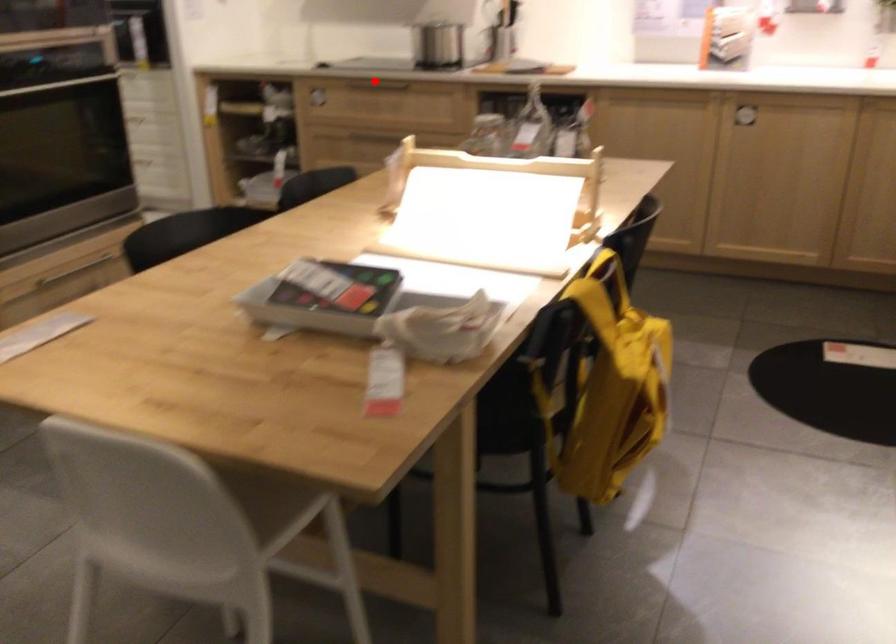
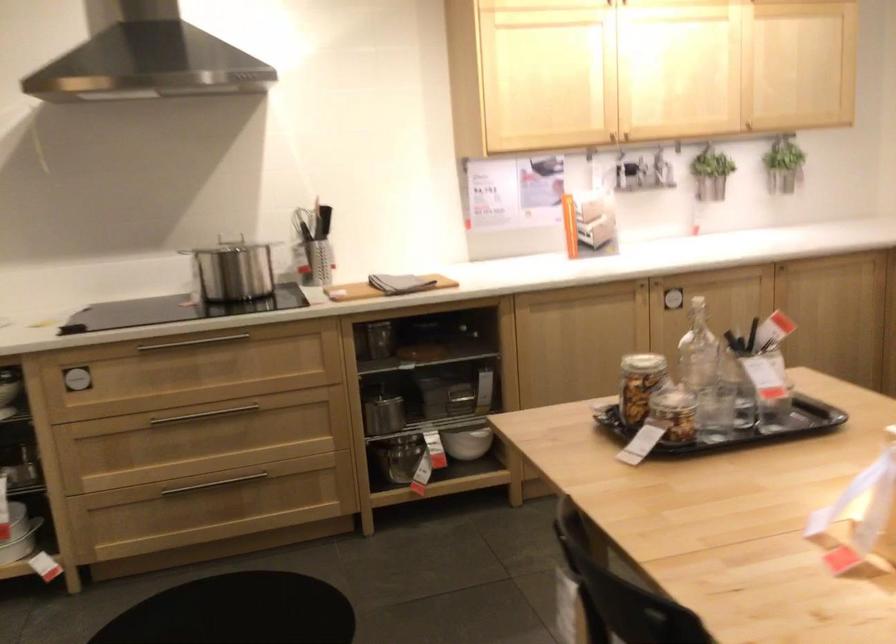
Question: I am providing you with two images of the same scene from different viewpoints. A red point is shown in image1. For the corresponding object point in image2, is it positioned nearer or farther from the camera?

Choices:
 (A) Nearer
 (B) Farther

Answer: (A)